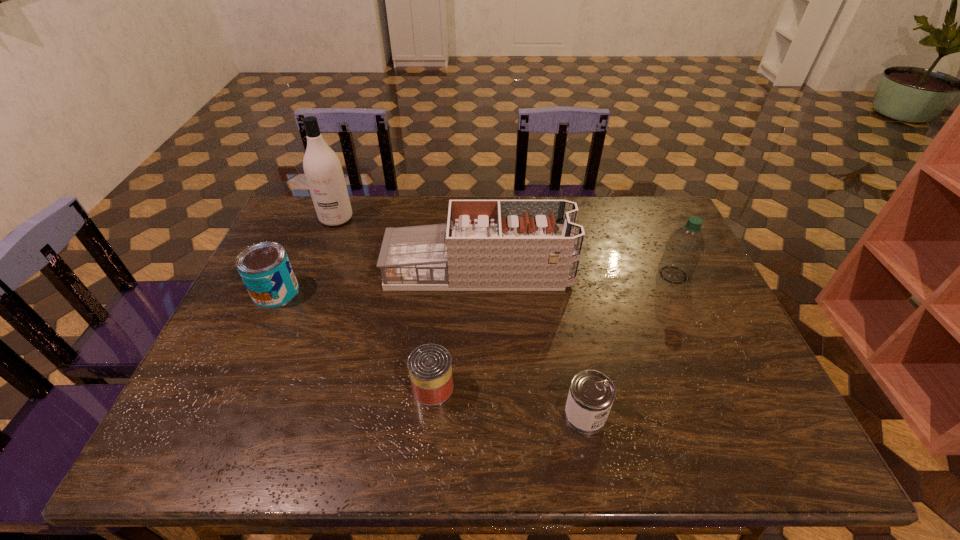
Identify the location of free space located 0.390m at the entrance of the dollhouse. This screenshot has height=540, width=960. (702, 271).

Locate an element on the screen. free space located on the front of the farthest can is located at coordinates (262, 322).

Where is `free region located on the left of the rightmost can`? free region located on the left of the rightmost can is located at coordinates (496, 415).

Where is `vacant space located 0.340m on the left of the second can from right to left`? The width and height of the screenshot is (960, 540). vacant space located 0.340m on the left of the second can from right to left is located at coordinates (267, 387).

Find the location of a particular element. The height and width of the screenshot is (540, 960). object located at the far edge is located at coordinates (323, 171).

Where is `object that is at the near edge`? This screenshot has width=960, height=540. object that is at the near edge is located at coordinates (591, 395).

The width and height of the screenshot is (960, 540). In order to click on shampoo present at the left edge in this screenshot , I will do [323, 171].

Identify the location of can present at the left edge. The image size is (960, 540). (265, 269).

I want to click on object that is positioned at the right edge, so click(684, 248).

Where is `object that is positioned at the far left corner`? object that is positioned at the far left corner is located at coordinates (323, 171).